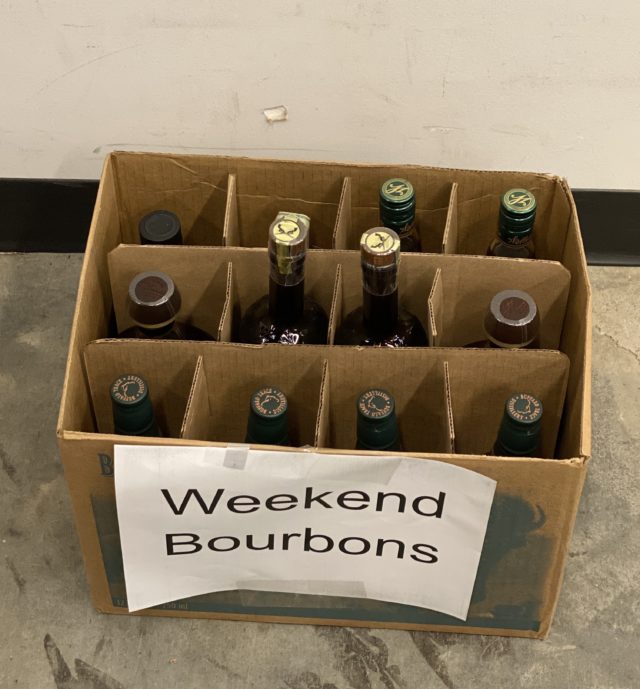
I want to click on white wall, so click(504, 110).